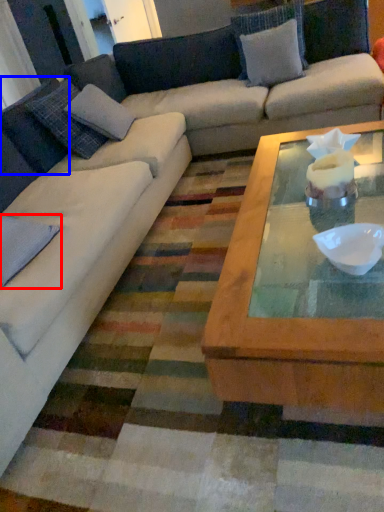
Question: Among these objects, which one is nearest to the camera, pillow (highlighted by a red box) or pillow (highlighted by a blue box)?

Choices:
 (A) pillow
 (B) pillow

Answer: (A)